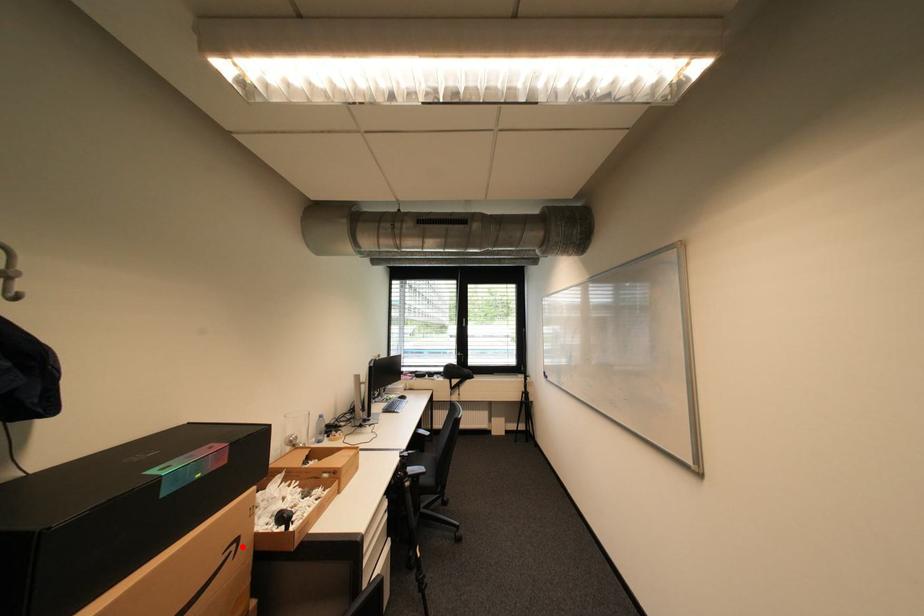
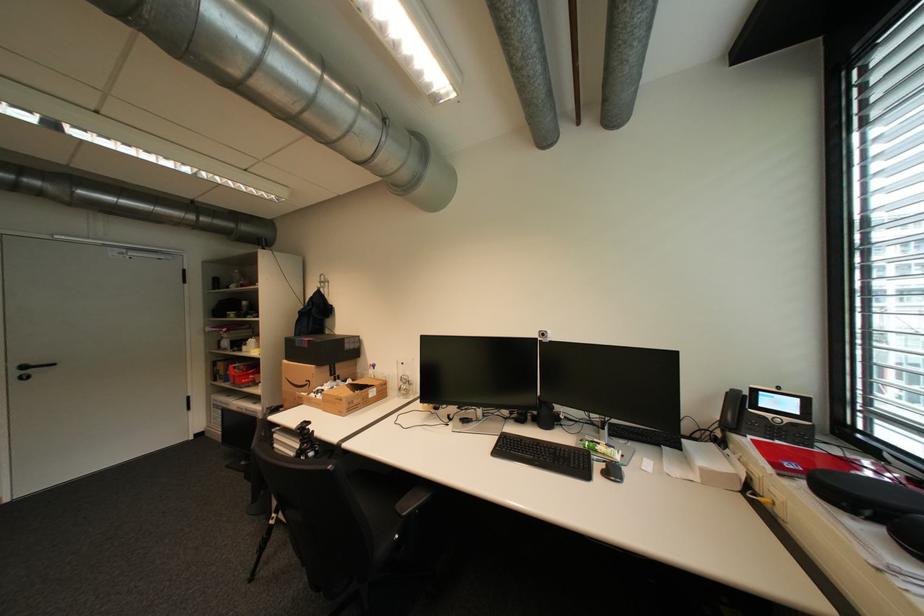
Question: I am providing you with two images of the same scene from different viewpoints. In image1, a red point is highlighted. Considering the same 3D point in image2, which of the following is correct?

Choices:
 (A) It is closer
 (B) It is farther

Answer: (B)